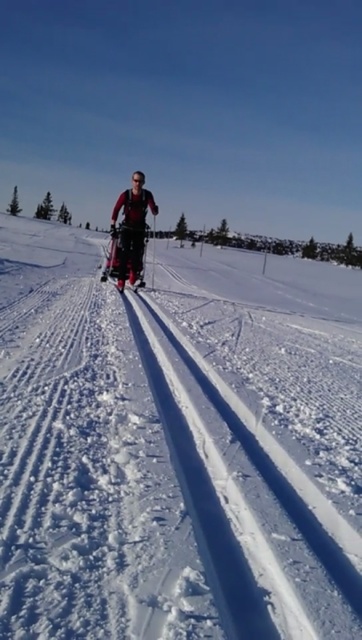
You are a photographer capturing the skier in the scene. You want to position your camera so that the matte black skisuit at center is on the left side of the frame and the white smooth snow at center is on the right side. Is this possible based on their current positions?

Yes, because the white smooth snow at center is already positioned to the right of the matte black skisuit at center, aligning with your desired framing.

You are a photographer planning to capture the skier in the scene. Considering the white smooth snow at center and the matte black skisuit at center, which object will appear brighter in the photo?

The white smooth snow at center will appear brighter in the photo because it reflects more light than the matte black skisuit at center.

You are a photographer standing at the camera position. You want to take a closeup photo of the white smooth snow at center. Do you think you can get close enough to the snow without stepping on it?

The white smooth snow at center and camera are 1.50 meters apart from each other, so yes, you can get close enough to the white smooth snow at center without stepping on it since the distance is manageable.